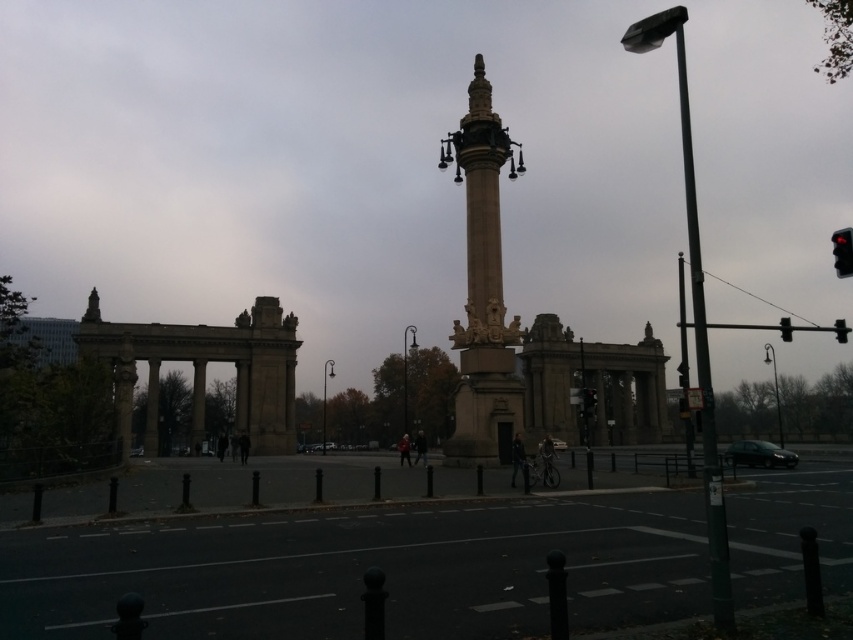
Can you confirm if smooth stone column at center is shorter than red plastic traffic light at right?

No.

From the picture: Between smooth stone column at center and red plastic traffic light at right, which one is positioned lower?

red plastic traffic light at right

Does point (512, 429) lie in front of point (788, 317)?

Yes, point (512, 429) is in front of point (788, 317).

Where is `smooth stone column at center`? The height and width of the screenshot is (640, 853). smooth stone column at center is located at coordinates (482, 291).

Is black glass traffic light at upper right behind black plastic traffic light at center-right?

No, it is in front of black plastic traffic light at center-right.

What do you see at coordinates (842, 252) in the screenshot? The image size is (853, 640). I see `black glass traffic light at upper right` at bounding box center [842, 252].

Locate an element on the screen. The image size is (853, 640). black glass traffic light at upper right is located at coordinates (842, 252).

Image resolution: width=853 pixels, height=640 pixels. Find the location of `black glass traffic light at upper right`. black glass traffic light at upper right is located at coordinates (842, 252).

This screenshot has width=853, height=640. Find the location of `black plastic traffic light at center-right`. black plastic traffic light at center-right is located at coordinates (589, 403).

Is point (587, 396) more distant than point (791, 330)?

No, it is in front of (791, 330).

Identify the location of black plastic traffic light at center-right. Image resolution: width=853 pixels, height=640 pixels. (589, 403).

This screenshot has width=853, height=640. Identify the location of black plastic traffic light at center-right. (589, 403).